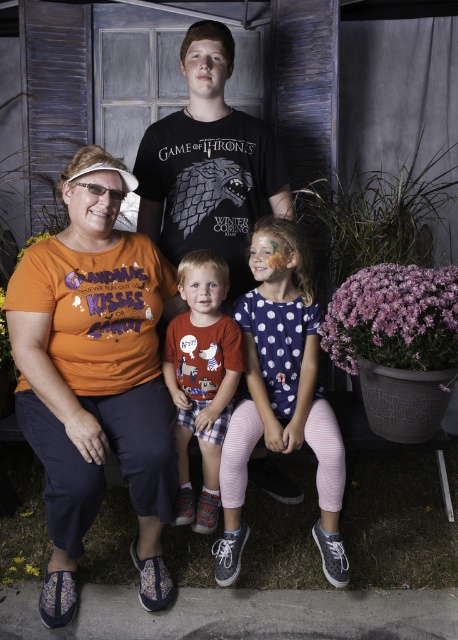
You are taking a photo of the scene described. The camera is at a certain distance from the point labeled as point (266, 438). If you want to ensure that the entire group of people is in focus, should you move closer or farther away from the point?

Since the camera is 6.76 feet away from point (266, 438), to ensure the entire group is in focus, you should move farther away from the point. This increases the depth of field, making more of the scene sharp.